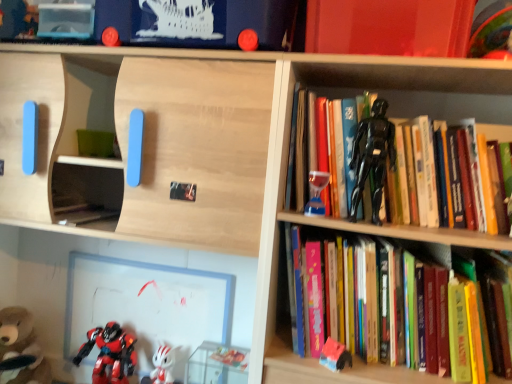
Question: Is white glossy figurine at lower center, acting as the fourth toy starting from the right, to the left of wooden shelf at upper center, positioned as the 2th shelf in back-to-front order, from the viewer's perspective?

Choices:
 (A) yes
 (B) no

Answer: (B)

Question: Is the depth of white glossy figurine at lower center, the 3th toy from the left, greater than that of wooden shelf at upper center, which is counted as the first shelf, starting from the front?

Choices:
 (A) no
 (B) yes

Answer: (B)

Question: From the image's perspective, is white glossy figurine at lower center, the 3th toy from the left, below wooden shelf at upper center, positioned as the 2th shelf in back-to-front order?

Choices:
 (A) no
 (B) yes

Answer: (B)

Question: Is white glossy figurine at lower center, acting as the fourth toy starting from the right, bigger than wooden shelf at upper center, positioned as the 2th shelf in back-to-front order?

Choices:
 (A) no
 (B) yes

Answer: (A)

Question: Is white glossy figurine at lower center, acting as the fourth toy starting from the right, aimed at wooden shelf at upper center, positioned as the 2th shelf in back-to-front order?

Choices:
 (A) yes
 (B) no

Answer: (A)

Question: From a real-world perspective, is white glossy figurine at lower center, the 3th toy from the left, physically located above or below black plastic action figure at upper right?

Choices:
 (A) below
 (B) above

Answer: (A)

Question: From their relative heights in the image, would you say white glossy figurine at lower center, the 3th toy from the left, is taller or shorter than black plastic action figure at upper right?

Choices:
 (A) short
 (B) tall

Answer: (A)

Question: Is white glossy figurine at lower center, the 3th toy from the left, bigger or smaller than black plastic action figure at upper right?

Choices:
 (A) big
 (B) small

Answer: (B)

Question: Is point (166, 365) closer or farther from the camera than point (289, 59)?

Choices:
 (A) closer
 (B) farther

Answer: (B)

Question: From a real-world perspective, relative to rubberized plastic toy at lower right, the 5th toy when ordered from left to right, is black glossy action figure at upper right, which is the 1th book in top-to-bottom order, vertically above or below?

Choices:
 (A) below
 (B) above

Answer: (B)

Question: Is black glossy action figure at upper right, which is the 2th book from bottom to top, taller or shorter than rubberized plastic toy at lower right, the 5th toy when ordered from left to right?

Choices:
 (A) short
 (B) tall

Answer: (B)

Question: In the image, is black glossy action figure at upper right, which is the 1th book in top-to-bottom order, on the left side or the right side of rubberized plastic toy at lower right, which ranks as the second toy in right-to-left order?

Choices:
 (A) right
 (B) left

Answer: (A)

Question: Looking at the image, does black glossy action figure at upper right, which is the 2th book from bottom to top, seem bigger or smaller compared to rubberized plastic toy at lower right, which ranks as the second toy in right-to-left order?

Choices:
 (A) small
 (B) big

Answer: (B)

Question: Is brown plush bear at lower left, marked as the sixth toy in a right-to-left arrangement, situated inside black glossy action figure at upper right, the 1th toy viewed from the right, or outside?

Choices:
 (A) outside
 (B) inside

Answer: (A)

Question: In terms of width, does brown plush bear at lower left, marked as the sixth toy in a right-to-left arrangement, look wider or thinner when compared to black glossy action figure at upper right, the sixth toy in the left-to-right sequence?

Choices:
 (A) thin
 (B) wide

Answer: (B)